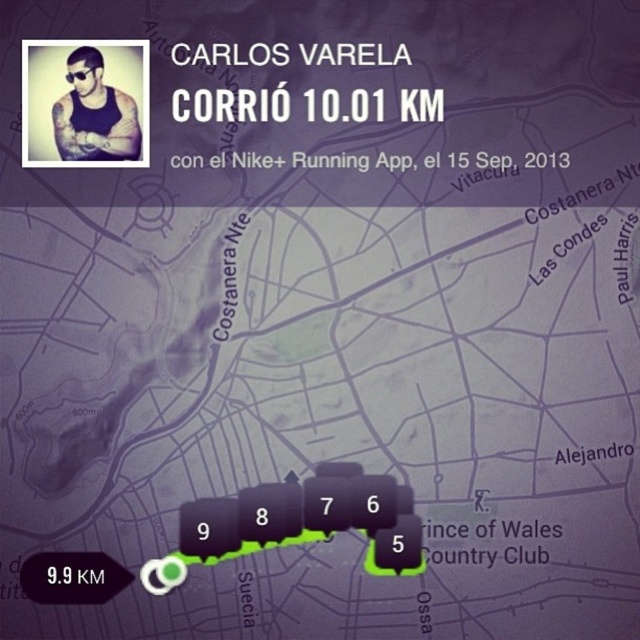
Question: Among these objects, which one is farthest from the camera?

Choices:
 (A) black plastic goggles at upper left
 (B) matte black tank top at upper left

Answer: (A)

Question: Which of the following is the closest to the observer?

Choices:
 (A) (80, 74)
 (B) (93, 138)

Answer: (A)

Question: From the image, what is the correct spatial relationship of matte black tank top at upper left in relation to black plastic goggles at upper left?

Choices:
 (A) above
 (B) below

Answer: (B)

Question: Does matte black tank top at upper left appear on the left side of black plastic goggles at upper left?

Choices:
 (A) no
 (B) yes

Answer: (A)

Question: Which object appears closest to the camera in this image?

Choices:
 (A) black plastic goggles at upper left
 (B) matte black tank top at upper left

Answer: (B)

Question: Where is matte black tank top at upper left located in relation to black plastic goggles at upper left in the image?

Choices:
 (A) above
 (B) below

Answer: (B)